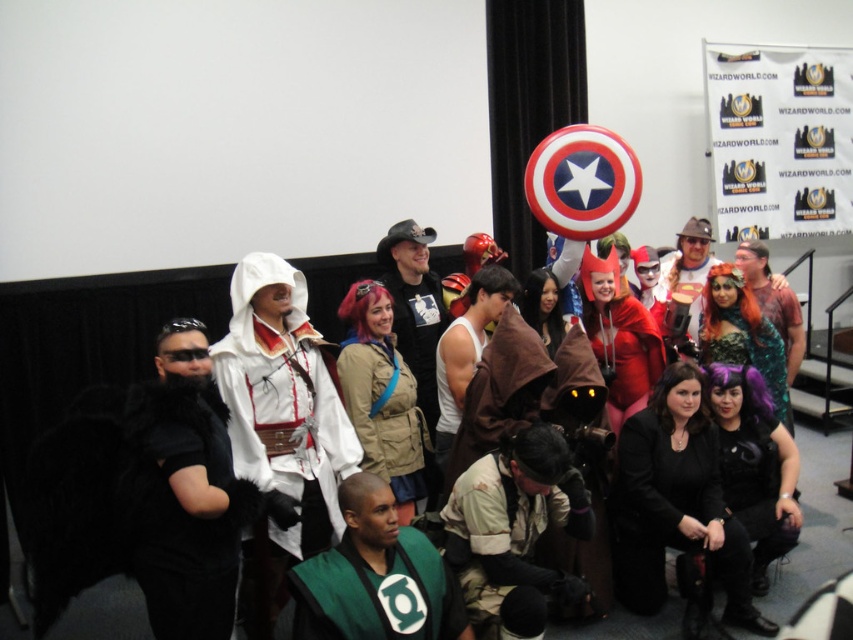
Question: Which point appears closest to the camera in this image?

Choices:
 (A) (537, 496)
 (B) (515, 284)
 (C) (422, 586)

Answer: (C)

Question: Which of the following is the closest to the observer?

Choices:
 (A) (753, 276)
 (B) (782, 369)
 (C) (479, 353)

Answer: (C)

Question: Can you confirm if camouflage fabric pants at center is positioned below shiny metallic armor at center?

Choices:
 (A) no
 (B) yes

Answer: (B)

Question: Which of these objects is positioned closest to the shiny metallic armor at center?

Choices:
 (A) white matte tank top at center
 (B) white satin robe at center
 (C) tan fabric jacket at center
 (D) camouflage fabric pants at center

Answer: (A)

Question: Is white satin robe at center to the left of matte brown hat at center from the viewer's perspective?

Choices:
 (A) yes
 (B) no

Answer: (A)

Question: Can you confirm if black furry vest at left is thinner than camouflage fabric pants at center?

Choices:
 (A) yes
 (B) no

Answer: (A)